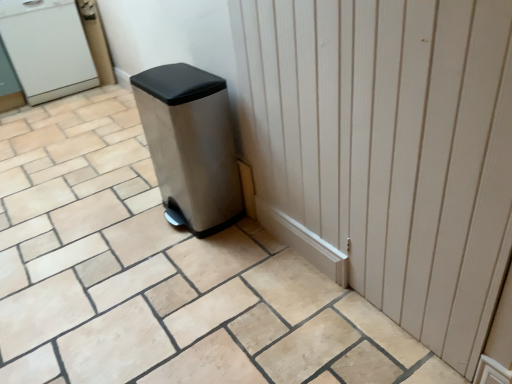
Where is `free area below white wood door at center (from a real-world perspective)`? The image size is (512, 384). free area below white wood door at center (from a real-world perspective) is located at coordinates (335, 283).